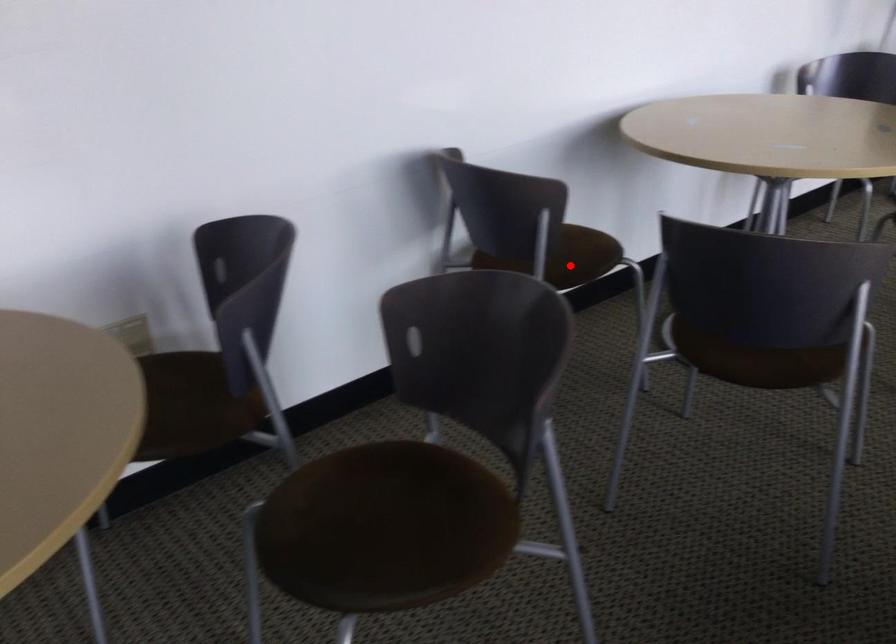
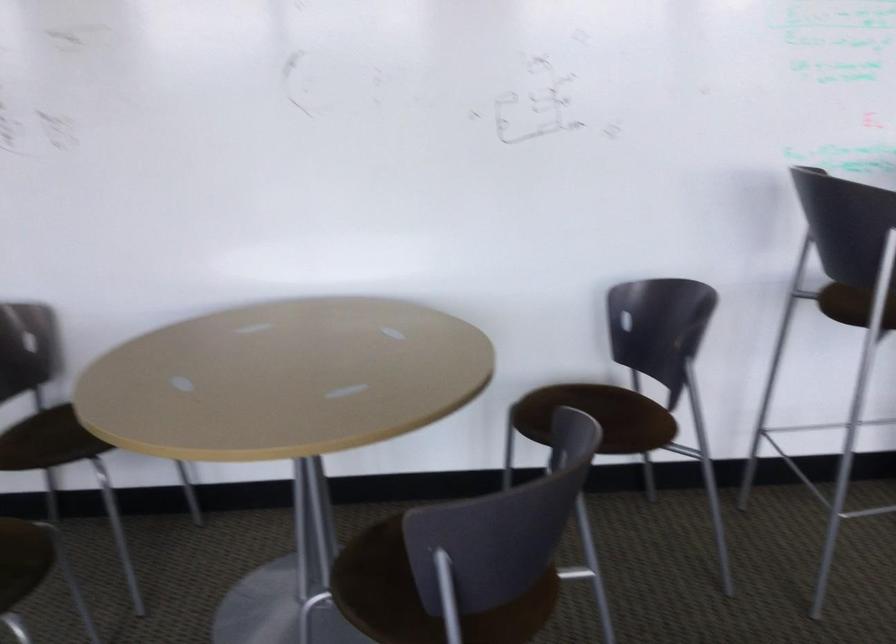
Find the pixel in the second image that matches the highlighted location in the first image.

(26, 442)